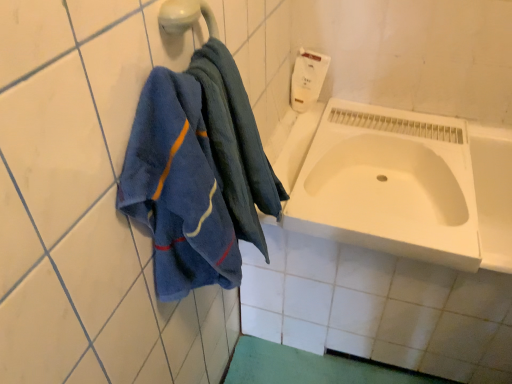
Question: Is white matte soap dispenser at upper right placed right next to white glossy bathtub at center?

Choices:
 (A) yes
 (B) no

Answer: (B)

Question: Is white matte soap dispenser at upper right positioned behind white glossy bathtub at center?

Choices:
 (A) yes
 (B) no

Answer: (A)

Question: Considering the relative sizes of white matte soap dispenser at upper right and white glossy bathtub at center in the image provided, is white matte soap dispenser at upper right shorter than white glossy bathtub at center?

Choices:
 (A) no
 (B) yes

Answer: (B)

Question: From a real-world perspective, is white matte soap dispenser at upper right under white glossy bathtub at center?

Choices:
 (A) yes
 (B) no

Answer: (B)

Question: Is white matte soap dispenser at upper right closer to camera compared to white glossy bathtub at center?

Choices:
 (A) yes
 (B) no

Answer: (B)

Question: From a real-world perspective, relative to white matte soap dispenser at upper right, is white matte sink at lower right vertically above or below?

Choices:
 (A) below
 (B) above

Answer: (A)

Question: Considering the positions of white matte sink at lower right and white matte soap dispenser at upper right in the image, is white matte sink at lower right wider or thinner than white matte soap dispenser at upper right?

Choices:
 (A) wide
 (B) thin

Answer: (A)

Question: Considering the positions of point (380, 208) and point (317, 77), is point (380, 208) closer or farther from the camera than point (317, 77)?

Choices:
 (A) closer
 (B) farther

Answer: (A)

Question: From the image's perspective, is white matte sink at lower right positioned above or below white matte soap dispenser at upper right?

Choices:
 (A) below
 (B) above

Answer: (A)

Question: From the image's perspective, relative to white glossy bathtub at center, is white matte soap dispenser at upper right above or below?

Choices:
 (A) above
 (B) below

Answer: (A)

Question: From a real-world perspective, is white matte soap dispenser at upper right above or below white glossy bathtub at center?

Choices:
 (A) above
 (B) below

Answer: (A)

Question: In terms of height, does white matte soap dispenser at upper right look taller or shorter compared to white glossy bathtub at center?

Choices:
 (A) short
 (B) tall

Answer: (A)

Question: Is white matte soap dispenser at upper right bigger or smaller than white glossy bathtub at center?

Choices:
 (A) small
 (B) big

Answer: (A)

Question: Would you say white matte soap dispenser at upper right is to the left or to the right of white matte sink at lower right in the picture?

Choices:
 (A) right
 (B) left

Answer: (B)

Question: From the image's perspective, relative to white matte sink at lower right, is white matte soap dispenser at upper right above or below?

Choices:
 (A) above
 (B) below

Answer: (A)